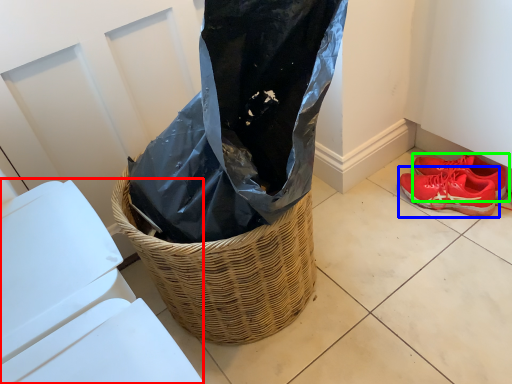
Question: Which object is the closest to the lift (highlighted by a red box)? Choose among these: footwear (highlighted by a blue box) or footwear (highlighted by a green box).

Choices:
 (A) footwear
 (B) footwear

Answer: (A)